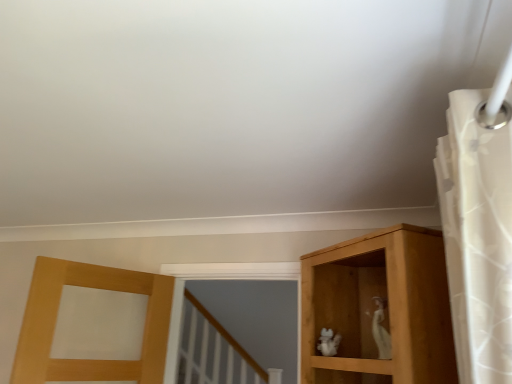
Question: From a real-world perspective, is white sheer fabric at upper right positioned above or below white porcelain cat at center-right?

Choices:
 (A) above
 (B) below

Answer: (A)

Question: In the image, is white sheer fabric at upper right on the left side or the right side of white porcelain cat at center-right?

Choices:
 (A) left
 (B) right

Answer: (B)

Question: Is point (448, 266) positioned closer to the camera than point (374, 334)?

Choices:
 (A) closer
 (B) farther

Answer: (A)

Question: Based on their positions, is white porcelain cat at center-right located to the left or right of white sheer fabric at upper right?

Choices:
 (A) left
 (B) right

Answer: (A)

Question: From the image's perspective, is white porcelain cat at center-right located above or below white sheer fabric at upper right?

Choices:
 (A) below
 (B) above

Answer: (A)

Question: Does point (382, 334) appear closer or farther from the camera than point (466, 349)?

Choices:
 (A) farther
 (B) closer

Answer: (A)

Question: In terms of height, does white porcelain cat at center-right look taller or shorter compared to white sheer fabric at upper right?

Choices:
 (A) tall
 (B) short

Answer: (B)